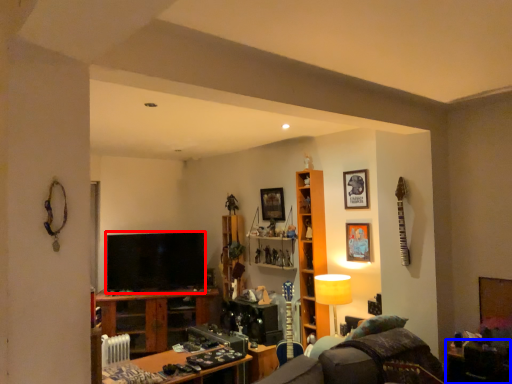
Question: Which object appears farthest to the camera in this image, television (highlighted by a red box) or table (highlighted by a blue box)?

Choices:
 (A) television
 (B) table

Answer: (A)